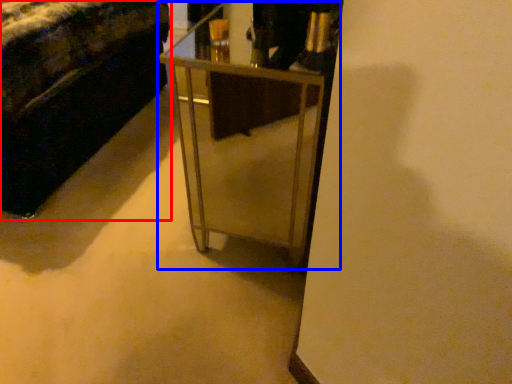
Question: Which of the following is the closest to the observer, furniture (highlighted by a red box) or table (highlighted by a blue box)?

Choices:
 (A) furniture
 (B) table

Answer: (B)